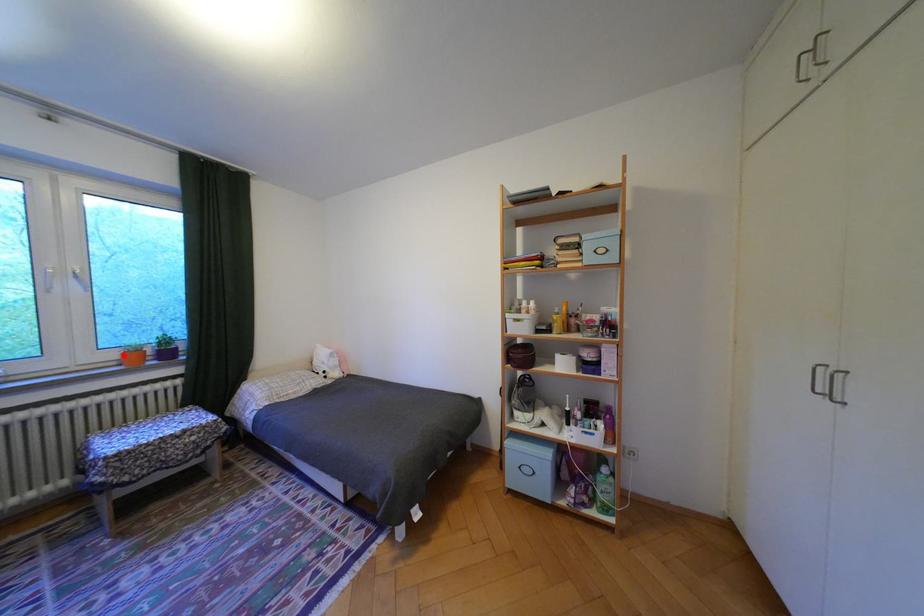
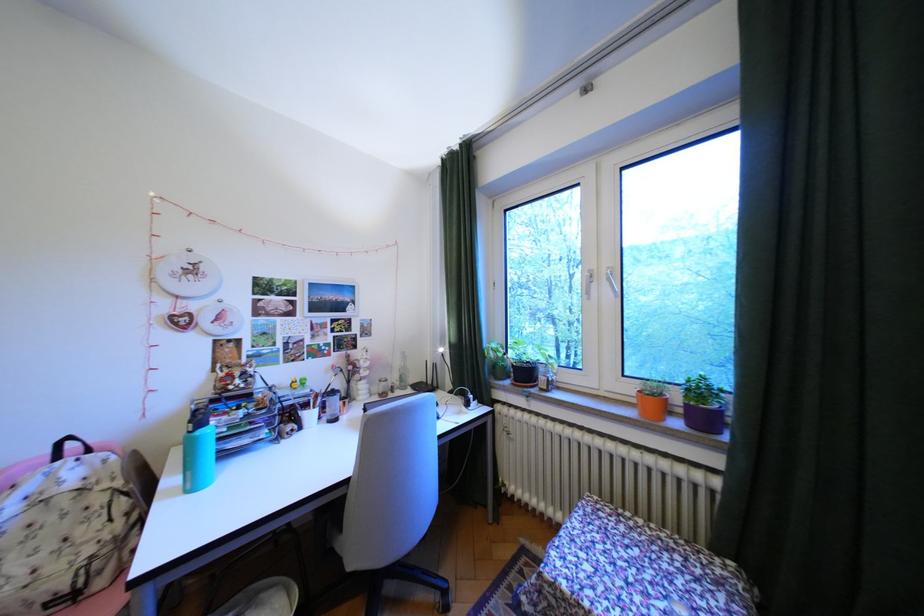
Question: I am providing you with two images of the same scene from different viewpoints. A red point is marked on the first image. Can you still see the location of the red point in image 2?

Choices:
 (A) Yes
 (B) No

Answer: (A)